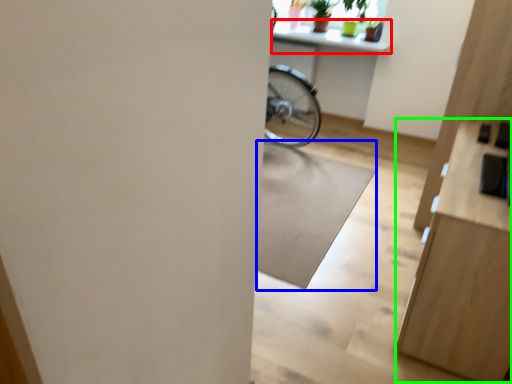
Question: Which is nearer to the counter top (highlighted by a red box)? mat (highlighted by a blue box) or dresser (highlighted by a green box).

Choices:
 (A) mat
 (B) dresser

Answer: (A)